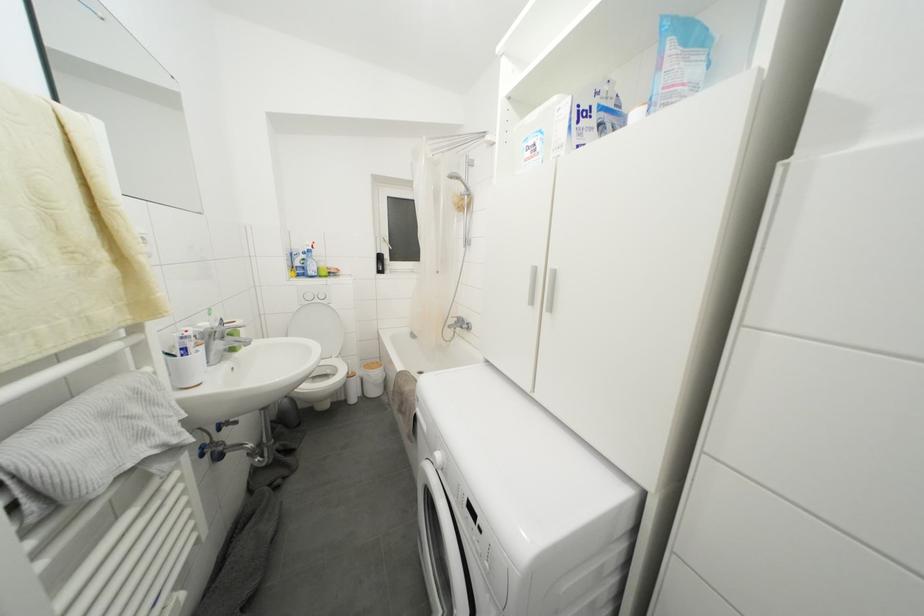
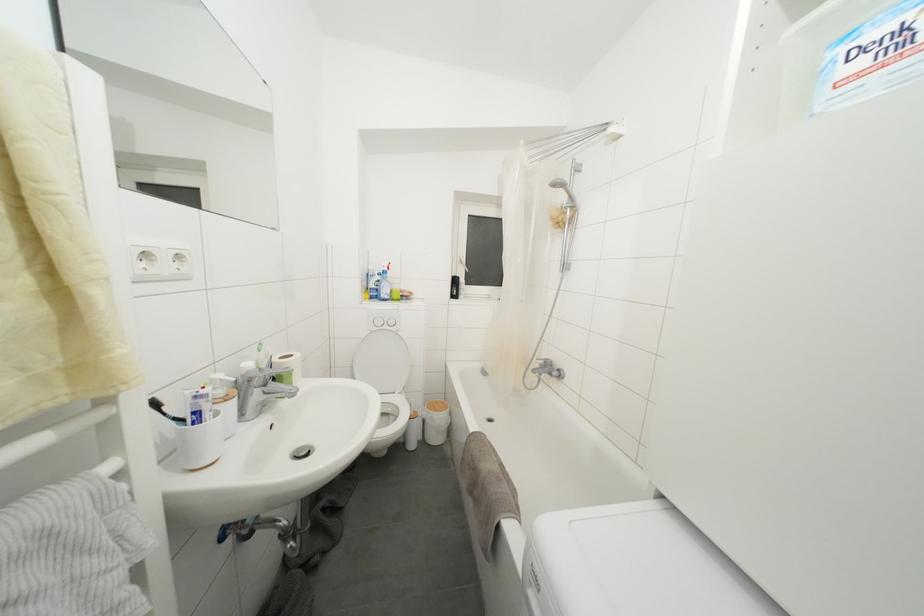
Where in the second image is the point corresponding to point (187, 342) from the first image?

(200, 402)